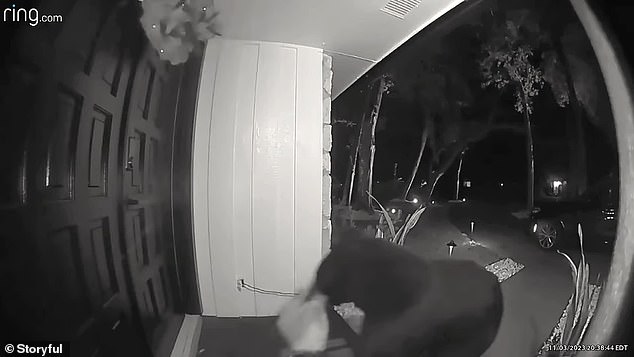
Find the location of a particular element. The image size is (634, 357). outlet with a cable and plug in it is located at coordinates (240, 285).